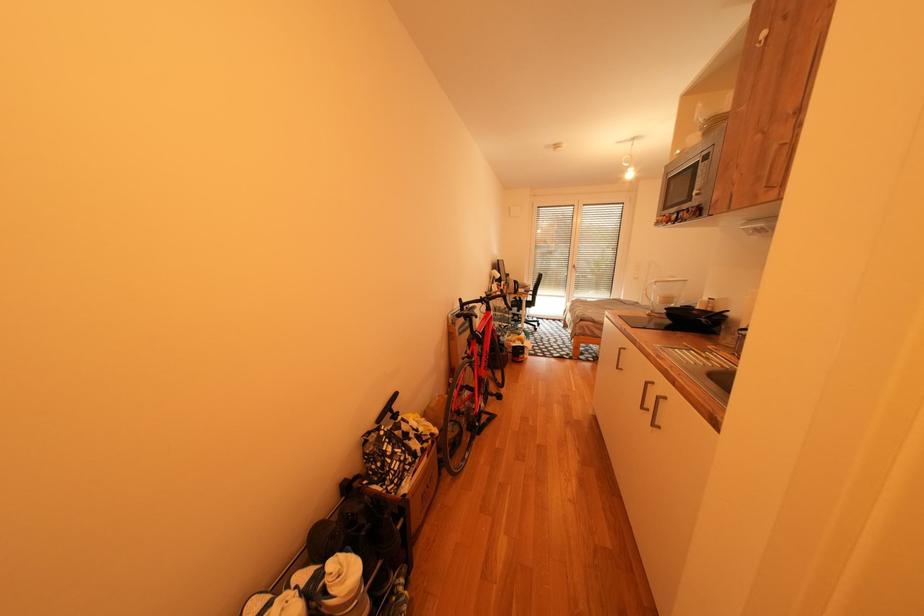
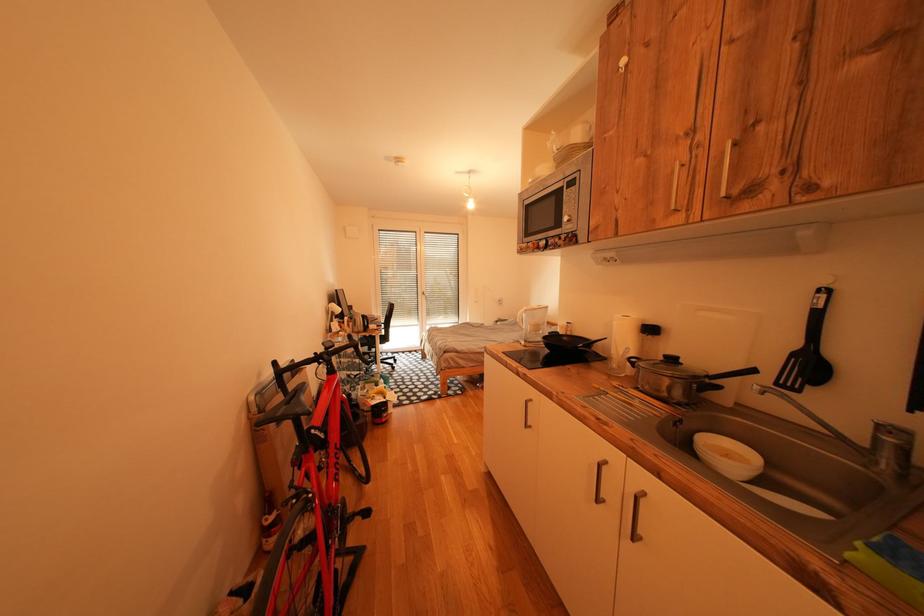
Question: The camera is either moving clockwise (left) or counter-clockwise (right) around the object. The first image is from the beginning of the video and the second image is from the end. Is the camera moving left or right when shooting the video?

Choices:
 (A) Left
 (B) Right

Answer: (A)